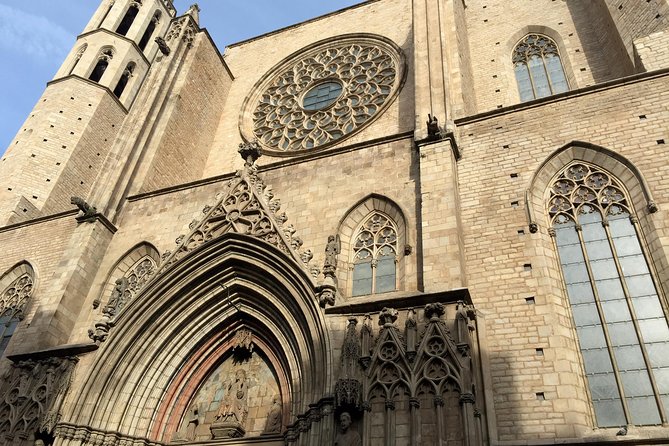
Find the location of a particular element. The height and width of the screenshot is (446, 669). colored tile sections top of door is located at coordinates (258, 395), (209, 394).